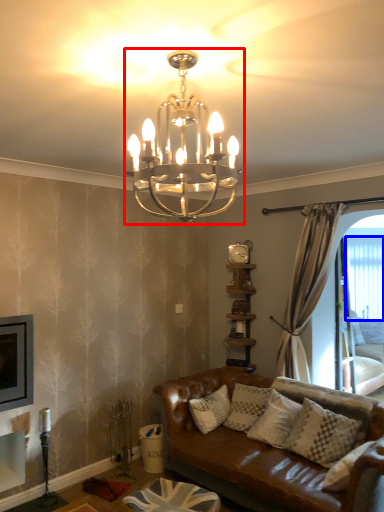
Question: Among these objects, which one is farthest to the camera, lamp (highlighted by a red box) or window screen (highlighted by a blue box)?

Choices:
 (A) lamp
 (B) window screen

Answer: (B)